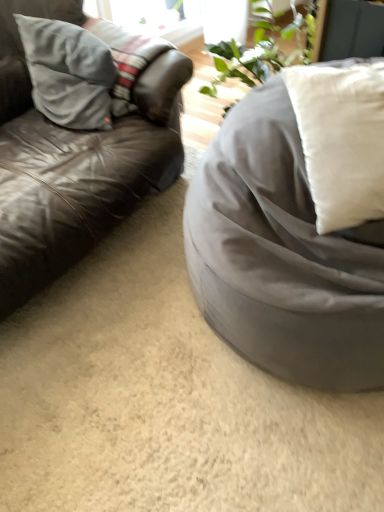
Question: Considering the relative positions of white soft cushion at right, which is the second pillow from left to right, and suede gray pillow at left, the 1th pillow positioned from the left, in the image provided, is white soft cushion at right, which is the second pillow from left to right, to the left of suede gray pillow at left, the 1th pillow positioned from the left, from the viewer's perspective?

Choices:
 (A) no
 (B) yes

Answer: (A)

Question: Is white soft cushion at right, arranged as the 1th pillow when viewed from the front, aimed at suede gray pillow at left, the second pillow when ordered from front to back?

Choices:
 (A) yes
 (B) no

Answer: (B)

Question: Does white soft cushion at right, positioned as the 1th pillow in right-to-left order, have a lesser width compared to suede gray pillow at left, the 2th pillow from the right?

Choices:
 (A) yes
 (B) no

Answer: (B)

Question: Is white soft cushion at right, which is the second pillow from left to right, to the right of suede gray pillow at left, the 2th pillow from the right, from the viewer's perspective?

Choices:
 (A) yes
 (B) no

Answer: (A)

Question: From the image's perspective, would you say white soft cushion at right, positioned as the 1th pillow in right-to-left order, is shown under suede gray pillow at left, the 1th pillow positioned from the left?

Choices:
 (A) yes
 (B) no

Answer: (A)

Question: In terms of height, does suede gray pillow at left, the 1th pillow positioned from the left, look taller or shorter compared to white soft cushion at right, arranged as the 1th pillow when viewed from the front?

Choices:
 (A) short
 (B) tall

Answer: (A)

Question: Considering the positions of suede gray pillow at left, the 1th pillow viewed from the back, and white soft cushion at right, arranged as the 1th pillow when viewed from the front, in the image, is suede gray pillow at left, the 1th pillow viewed from the back, wider or thinner than white soft cushion at right, arranged as the 1th pillow when viewed from the front,?

Choices:
 (A) thin
 (B) wide

Answer: (A)

Question: From a real-world perspective, is suede gray pillow at left, the 1th pillow viewed from the back, positioned above or below white soft cushion at right, which is the second pillow from left to right?

Choices:
 (A) above
 (B) below

Answer: (B)

Question: Is point (59, 114) closer or farther from the camera than point (377, 179)?

Choices:
 (A) farther
 (B) closer

Answer: (A)

Question: Looking at their shapes, would you say leather couch at left is wider or thinner than white soft cushion at right, which is the second pillow from back to front?

Choices:
 (A) wide
 (B) thin

Answer: (A)

Question: Is leather couch at left inside the boundaries of white soft cushion at right, positioned as the 1th pillow in right-to-left order, or outside?

Choices:
 (A) outside
 (B) inside

Answer: (A)

Question: From the image's perspective, relative to white soft cushion at right, which is the second pillow from back to front, is leather couch at left above or below?

Choices:
 (A) above
 (B) below

Answer: (A)

Question: In the image, is leather couch at left positioned in front of or behind white soft cushion at right, positioned as the 1th pillow in right-to-left order?

Choices:
 (A) front
 (B) behind

Answer: (A)

Question: From the image's perspective, is suede gray pillow at left, the 2th pillow from the right, positioned above or below satin gray bean bag at right?

Choices:
 (A) below
 (B) above

Answer: (B)

Question: Is suede gray pillow at left, the 2th pillow from the right, to the left or to the right of satin gray bean bag at right in the image?

Choices:
 (A) left
 (B) right

Answer: (A)